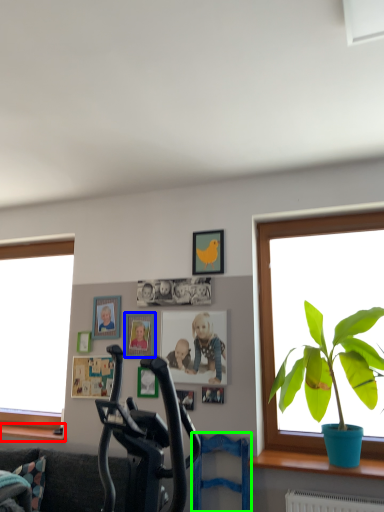
Question: Considering the real-world distances, which object is closest to window sill (highlighted by a red box)? picture frame (highlighted by a blue box) or swivel chair (highlighted by a green box).

Choices:
 (A) picture frame
 (B) swivel chair

Answer: (A)